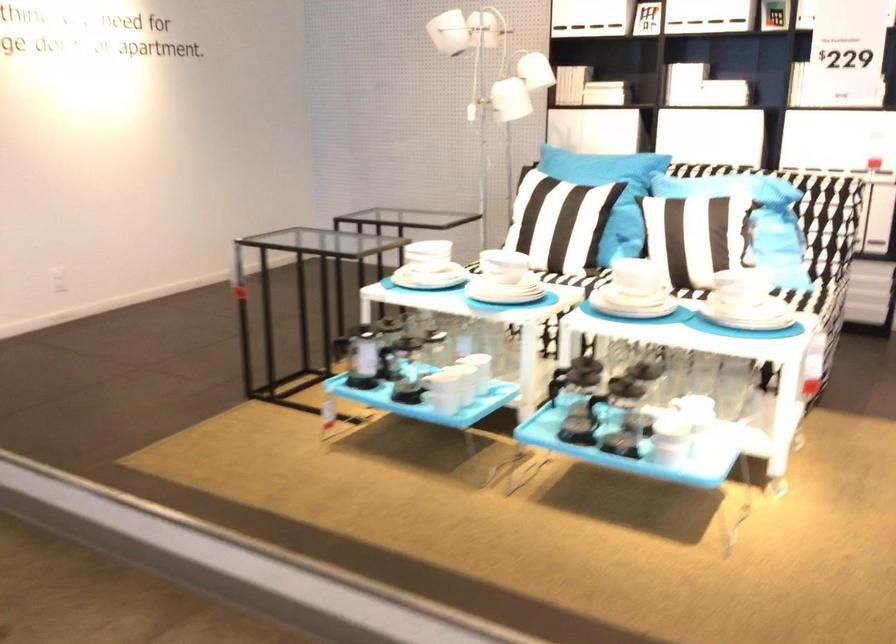
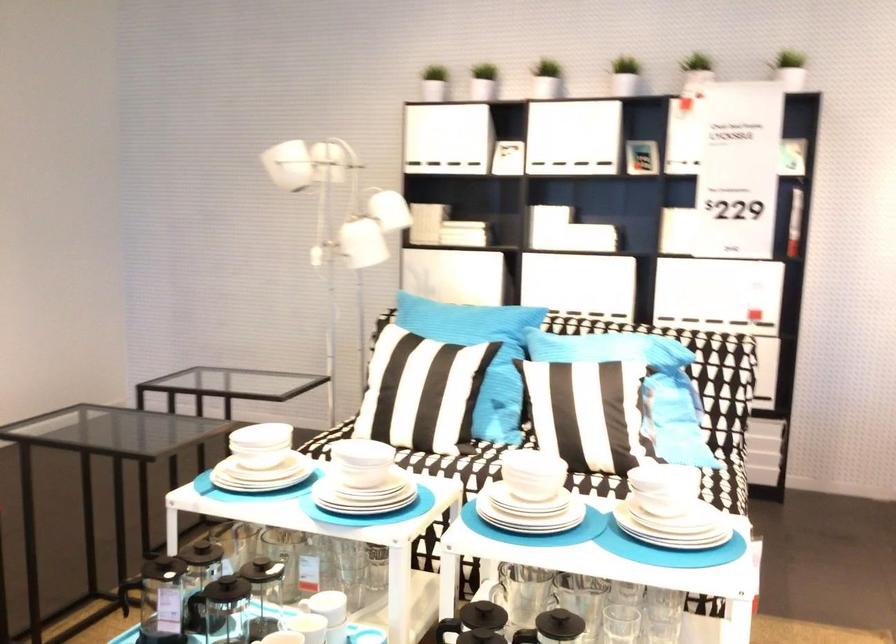
Where in the second image is the point corresponding to [600,158] from the first image?

(467, 324)